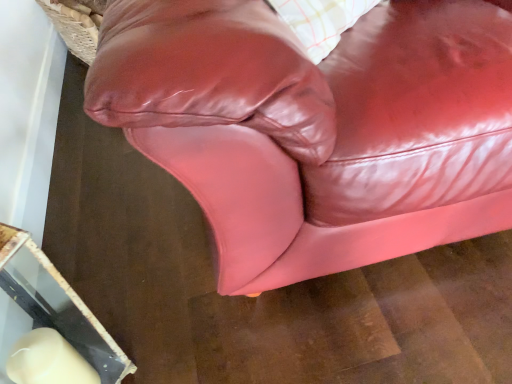
Question: Is glossy leather couch at center smaller than glossy leather pillow at upper center?

Choices:
 (A) no
 (B) yes

Answer: (A)

Question: Is glossy leather couch at center positioned far away from glossy leather pillow at upper center?

Choices:
 (A) no
 (B) yes

Answer: (A)

Question: Is glossy leather couch at center not inside glossy leather pillow at upper center?

Choices:
 (A) yes
 (B) no

Answer: (A)

Question: Is glossy leather couch at center closer to the viewer compared to glossy leather pillow at upper center?

Choices:
 (A) yes
 (B) no

Answer: (B)

Question: From a real-world perspective, is glossy leather couch at center below glossy leather pillow at upper center?

Choices:
 (A) yes
 (B) no

Answer: (A)

Question: Is glossy leather couch at center facing towards glossy leather pillow at upper center?

Choices:
 (A) no
 (B) yes

Answer: (A)

Question: Are glossy leather pillow at upper center and glossy leather couch at center far apart?

Choices:
 (A) no
 (B) yes

Answer: (A)

Question: Does glossy leather pillow at upper center have a larger size compared to glossy leather couch at center?

Choices:
 (A) yes
 (B) no

Answer: (B)

Question: Does glossy leather pillow at upper center have a smaller size compared to glossy leather couch at center?

Choices:
 (A) yes
 (B) no

Answer: (A)

Question: Is glossy leather pillow at upper center directly adjacent to glossy leather couch at center?

Choices:
 (A) yes
 (B) no

Answer: (B)

Question: From a real-world perspective, does glossy leather pillow at upper center sit lower than glossy leather couch at center?

Choices:
 (A) yes
 (B) no

Answer: (B)

Question: Is glossy leather pillow at upper center taller than glossy leather couch at center?

Choices:
 (A) yes
 (B) no

Answer: (A)

Question: Looking at their shapes, would you say glossy leather couch at center is wider or thinner than glossy leather pillow at upper center?

Choices:
 (A) thin
 (B) wide

Answer: (B)